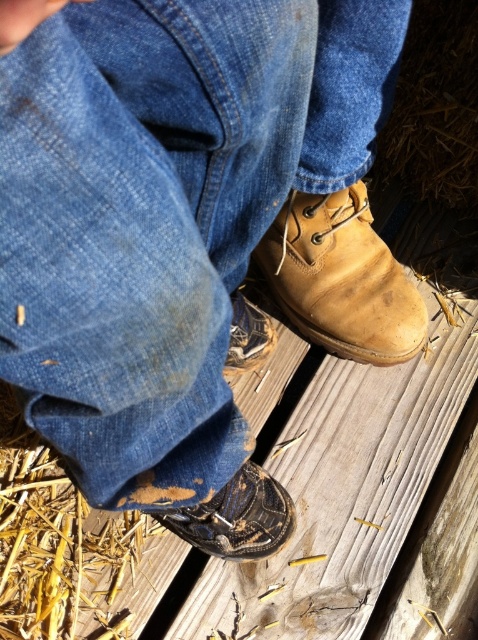
Can you confirm if leather boot at center is positioned above brown leather shoe at lower center?

Yes, leather boot at center is above brown leather shoe at lower center.

Find the location of a particular element. Image resolution: width=478 pixels, height=640 pixels. leather boot at center is located at coordinates (341, 278).

Who is taller, leather boot at lower center or brown leather shoe at lower center?

leather boot at lower center is taller.

Describe the element at coordinates (237, 516) in the screenshot. The image size is (478, 640). I see `leather boot at lower center` at that location.

Measure the distance between leather boot at lower center and camera.

leather boot at lower center and camera are 92.08 centimeters apart from each other.

Identify the location of leather boot at lower center. The image size is (478, 640). (237, 516).

Which is behind, point (317, 291) or point (271, 552)?

The point (317, 291) is behind.

Does point (322, 260) lie in front of point (228, 541)?

That is False.

Who is more distant from viewer, (x=292, y=268) or (x=198, y=531)?

Point (x=292, y=268)

You are a GUI agent. You are given a task and a screenshot of the screen. Output one action in this format:
    pyautogui.click(x=<x>, y=<y>)
    Task: Click on the leather boot at center
    
    Given the screenshot: What is the action you would take?
    pyautogui.click(x=341, y=278)